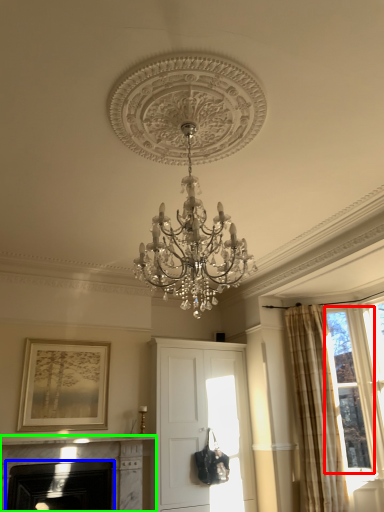
Question: Considering the real-world distances, which object is closest to bay window (highlighted by a red box)? fireplace (highlighted by a blue box) or fireplace (highlighted by a green box).

Choices:
 (A) fireplace
 (B) fireplace

Answer: (B)